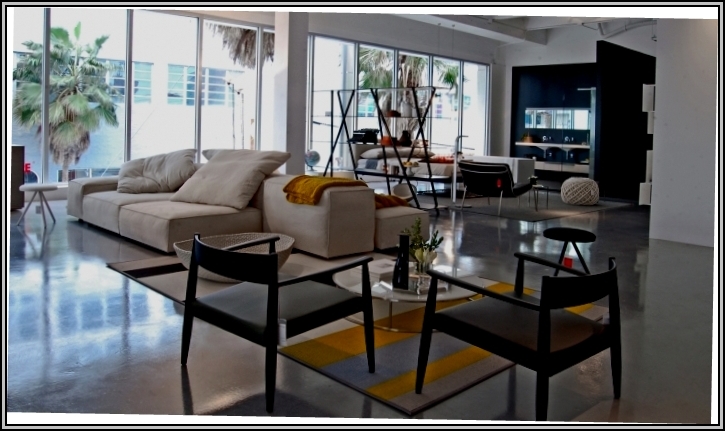
The height and width of the screenshot is (431, 725). In order to click on floor in this screenshot , I will do pyautogui.click(x=72, y=307).